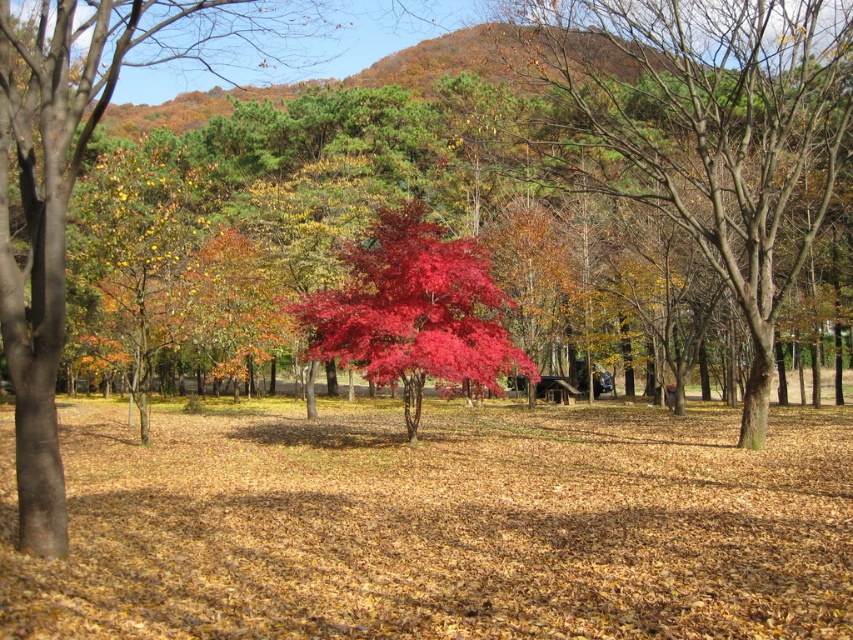
Question: In this image, where is shiny red maple tree at center located relative to vivid crimson leaves at center?

Choices:
 (A) below
 (B) above

Answer: (B)

Question: Which point appears closest to the camera in this image?

Choices:
 (A) (358, 259)
 (B) (563, 80)

Answer: (A)

Question: Does shiny red maple tree at center have a smaller size compared to vivid crimson leaves at center?

Choices:
 (A) yes
 (B) no

Answer: (B)

Question: Considering the relative positions of shiny red maple tree at center and vivid crimson leaves at center in the image provided, where is shiny red maple tree at center located with respect to vivid crimson leaves at center?

Choices:
 (A) above
 (B) below

Answer: (A)

Question: Which object is closer to the camera taking this photo?

Choices:
 (A) shiny red maple tree at center
 (B) vivid crimson leaves at center

Answer: (A)